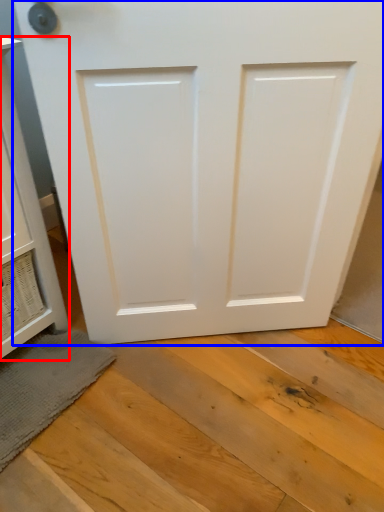
Question: Which of the following is the farthest to the observer, cabinetry (highlighted by a red box) or door (highlighted by a blue box)?

Choices:
 (A) cabinetry
 (B) door

Answer: (B)